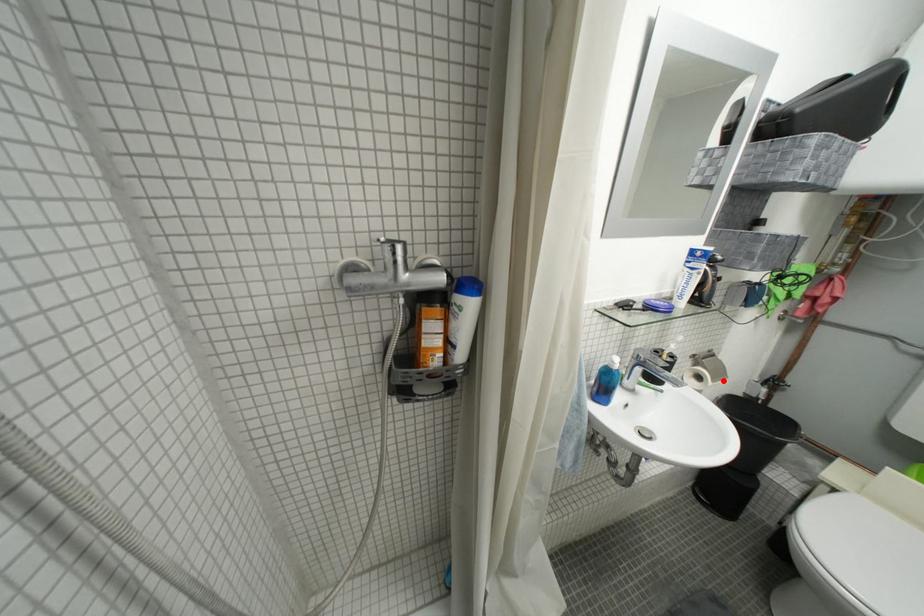
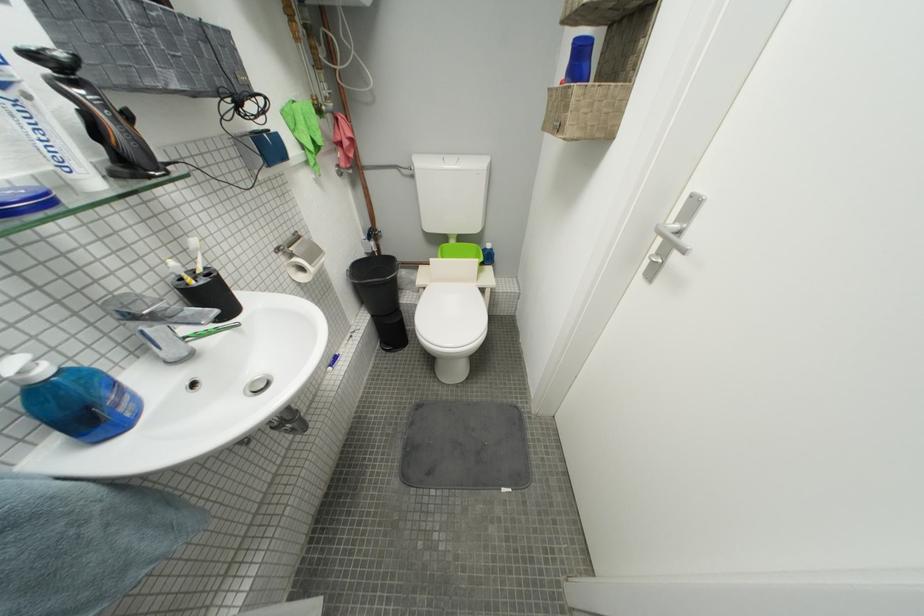
Question: I am providing you with two images of the same scene from different viewpoints. In image1, a red point is highlighted. Considering the same 3D point in image2, which of the following is correct?

Choices:
 (A) It is closer
 (B) It is farther

Answer: (A)